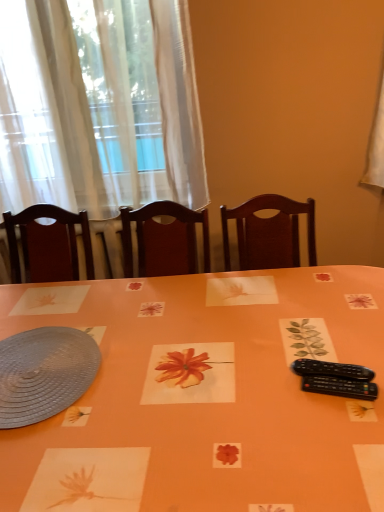
Measure the distance between point (3, 379) and camera.

Point (3, 379) is 1.13 meters away from camera.

You are a GUI agent. You are given a task and a screenshot of the screen. Output one action in this format:
    pyautogui.click(x=<x>, y=<y>)
    Task: Click on the matte gray platter at lower left
    Image resolution: width=384 pixels, height=512 pixels.
    Given the screenshot: What is the action you would take?
    pyautogui.click(x=44, y=373)

This screenshot has height=512, width=384. Describe the element at coordinates (204, 400) in the screenshot. I see `orange paper placemat at center` at that location.

Describe the element at coordinates (340, 387) in the screenshot. Image resolution: width=384 pixels, height=512 pixels. I see `black plastic remote at lower right` at that location.

This screenshot has height=512, width=384. I want to click on matte gray platter at lower left, so click(44, 373).

Can we say black plastic remote at lower right lies outside orange paper placemat at center?

Actually, black plastic remote at lower right is within orange paper placemat at center.

Considering the sizes of objects black plastic remote at lower right and orange paper placemat at center in the image provided, who is taller, black plastic remote at lower right or orange paper placemat at center?

orange paper placemat at center is taller.

Can you confirm if black plastic remote at lower right is positioned to the left of orange paper placemat at center?

No.

From the image's perspective, does white sheer curtain at upper left appear lower than black plastic remote at lower right?

No, from the image's perspective, white sheer curtain at upper left is not beneath black plastic remote at lower right.

Is white sheer curtain at upper left smaller than black plastic remote at lower right?

Incorrect, white sheer curtain at upper left is not smaller in size than black plastic remote at lower right.

There is a black plastic remote at lower right. Identify the location of curtain above it (from a real-world perspective). This screenshot has height=512, width=384. (98, 106).

How far apart are orange paper placemat at center and matte gray platter at lower left?

They are 10.06 inches apart.

Is matte gray platter at lower left inside orange paper placemat at center?

Yes, matte gray platter at lower left is a part of orange paper placemat at center.

Considering their positions, is orange paper placemat at center located in front of or behind matte gray platter at lower left?

orange paper placemat at center is in front of matte gray platter at lower left.

Based on the photo, does matte gray platter at lower left have a greater width compared to orange paper placemat at center?

No, matte gray platter at lower left is not wider than orange paper placemat at center.

Is matte gray platter at lower left closer to the viewer compared to orange paper placemat at center?

No, matte gray platter at lower left is behind orange paper placemat at center.

Consider the image. Is matte gray platter at lower left to the right of orange paper placemat at center from the viewer's perspective?

Incorrect, matte gray platter at lower left is not on the right side of orange paper placemat at center.

Considering the positions of points (61, 347) and (120, 343), is point (61, 347) closer to camera compared to point (120, 343)?

Yes.

At what (x,y) coordinates should I click in order to perform the action: click on curtain above the black plastic remote at lower right (from the image's perspective). Please return your answer as a coordinate pair (x, y). This screenshot has height=512, width=384. Looking at the image, I should click on (98, 106).

Between black plastic remote at lower right and white sheer curtain at upper left, which one has more height?

With more height is white sheer curtain at upper left.

Can you confirm if black plastic remote at lower right is wider than white sheer curtain at upper left?

In fact, black plastic remote at lower right might be narrower than white sheer curtain at upper left.

Is black plastic remote at lower right inside the boundaries of white sheer curtain at upper left, or outside?

black plastic remote at lower right is spatially situated outside white sheer curtain at upper left.

From a real-world perspective, which object stands above the other?

white sheer curtain at upper left, from a real-world perspective.

Is orange paper placemat at center not within white sheer curtain at upper left?

Yes, orange paper placemat at center is not within white sheer curtain at upper left.

Can you confirm if orange paper placemat at center is shorter than white sheer curtain at upper left?

Indeed, orange paper placemat at center has a lesser height compared to white sheer curtain at upper left.

Considering the points (216, 455) and (88, 88), which point is in front, point (216, 455) or point (88, 88)?

The point (216, 455) is closer to the camera.

Identify the location of platter behind the black plastic remote at lower right. (44, 373).

Which is closer to the camera, (11, 351) or (363, 392)?

Clearly, point (11, 351) is more distant from the camera than point (363, 392).

Considering the relative positions of matte gray platter at lower left and black plastic remote at lower right in the image provided, is matte gray platter at lower left to the left or to the right of black plastic remote at lower right?

Clearly, matte gray platter at lower left is on the left of black plastic remote at lower right in the image.

Is black plastic remote at lower right completely or partially inside matte gray platter at lower left?

No, matte gray platter at lower left does not contain black plastic remote at lower right.

At what (x,y) coordinates should I click in order to perform the action: click on table to the left of black plastic remote at lower right. Please return your answer as a coordinate pair (x, y). Looking at the image, I should click on (204, 400).

I want to click on curtain above the black plastic remote at lower right (from a real-world perspective), so click(x=98, y=106).

Estimate the real-world distances between objects in this image. Which object is further from orange paper placemat at center, white sheer curtain at upper left or matte gray platter at lower left?

white sheer curtain at upper left is further to orange paper placemat at center.

When comparing their distances from matte gray platter at lower left, does white sheer curtain at upper left or orange paper placemat at center seem further?

Based on the image, white sheer curtain at upper left appears to be further to matte gray platter at lower left.

Based on their spatial positions, is orange paper placemat at center or white sheer curtain at upper left closer to matte gray platter at lower left?

Based on the image, orange paper placemat at center appears to be nearer to matte gray platter at lower left.

Based on the photo, when comparing their distances from white sheer curtain at upper left, does matte gray platter at lower left or black plastic remote at lower right seem closer?

matte gray platter at lower left lies closer to white sheer curtain at upper left than the other object.

From the image, which object appears to be nearer to orange paper placemat at center, black plastic remote at lower right or matte gray platter at lower left?

matte gray platter at lower left is positioned closer to the anchor orange paper placemat at center.

Based on their spatial positions, is white sheer curtain at upper left or matte gray platter at lower left further from black plastic remote at lower right?

white sheer curtain at upper left.

When comparing their distances from matte gray platter at lower left, does black plastic remote at lower right or orange paper placemat at center seem closer?

Based on the image, orange paper placemat at center appears to be nearer to matte gray platter at lower left.

When comparing their distances from black plastic remote at lower right, does orange paper placemat at center or white sheer curtain at upper left seem closer?

The object closer to black plastic remote at lower right is orange paper placemat at center.

Find the location of `control between white sheer curtain at upper left and orange paper placemat at center in the vertical direction`. control between white sheer curtain at upper left and orange paper placemat at center in the vertical direction is located at coordinates (340, 387).

Find the location of `control that lies between white sheer curtain at upper left and matte gray platter at lower left from top to bottom`. control that lies between white sheer curtain at upper left and matte gray platter at lower left from top to bottom is located at coordinates (x=340, y=387).

This screenshot has height=512, width=384. In order to click on table between matte gray platter at lower left and black plastic remote at lower right in this screenshot , I will do `click(204, 400)`.

Locate an element on the screen. platter that lies between white sheer curtain at upper left and orange paper placemat at center from top to bottom is located at coordinates (44, 373).